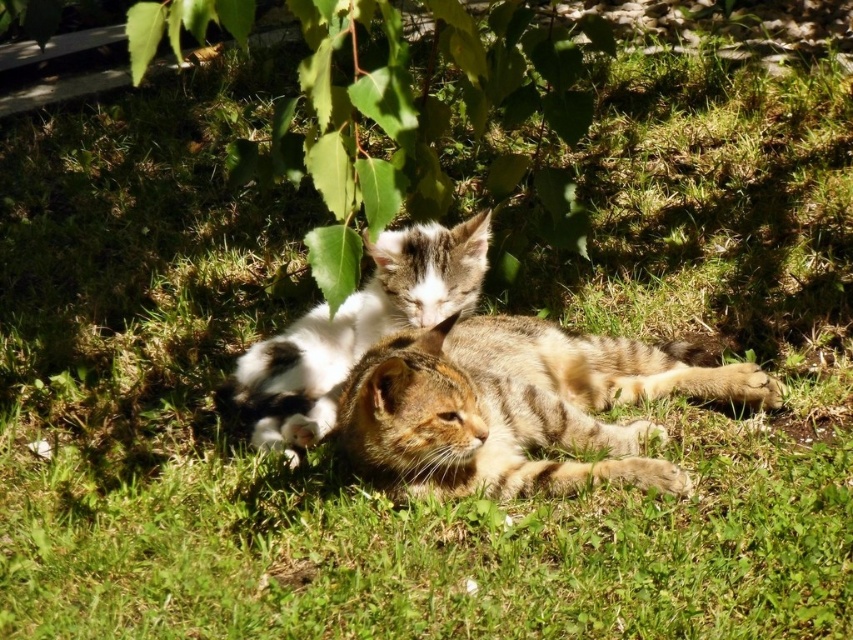
Who is positioned more to the left, tabby fur cat at center or white fur cat at center?

white fur cat at center is more to the left.

Who is more forward, (430, 381) or (401, 260)?

Point (430, 381)

This screenshot has height=640, width=853. What are the coordinates of `tabby fur cat at center` in the screenshot? It's located at (518, 406).